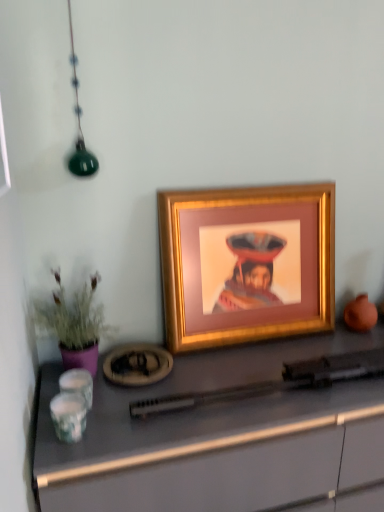
Question: Is matte gray desk at center completely or partially inside gold metallic picture frame at center?

Choices:
 (A) no
 (B) yes

Answer: (A)

Question: Can you confirm if gold metallic picture frame at center is wider than matte gray desk at center?

Choices:
 (A) yes
 (B) no

Answer: (B)

Question: From the image's perspective, is gold metallic picture frame at center below matte gray desk at center?

Choices:
 (A) yes
 (B) no

Answer: (B)

Question: Is gold metallic picture frame at center smaller than matte gray desk at center?

Choices:
 (A) no
 (B) yes

Answer: (B)

Question: Is gold metallic picture frame at center to the right of matte gray desk at center from the viewer's perspective?

Choices:
 (A) yes
 (B) no

Answer: (B)

Question: From the image's perspective, is gold metallic picture frame at center over matte gray desk at center?

Choices:
 (A) no
 (B) yes

Answer: (B)

Question: From a real-world perspective, does purple matte plant at left stand above gold metallic picture frame at center?

Choices:
 (A) no
 (B) yes

Answer: (A)

Question: From a real-world perspective, does purple matte plant at left sit lower than gold metallic picture frame at center?

Choices:
 (A) no
 (B) yes

Answer: (B)

Question: Is purple matte plant at left thinner than gold metallic picture frame at center?

Choices:
 (A) yes
 (B) no

Answer: (B)

Question: Can you confirm if purple matte plant at left is wider than gold metallic picture frame at center?

Choices:
 (A) no
 (B) yes

Answer: (B)

Question: From the image's perspective, is purple matte plant at left over gold metallic picture frame at center?

Choices:
 (A) no
 (B) yes

Answer: (A)

Question: Is purple matte plant at left further to camera compared to gold metallic picture frame at center?

Choices:
 (A) no
 (B) yes

Answer: (A)

Question: Does gold metallic picture frame at center have a larger size compared to purple matte plant at left?

Choices:
 (A) no
 (B) yes

Answer: (B)